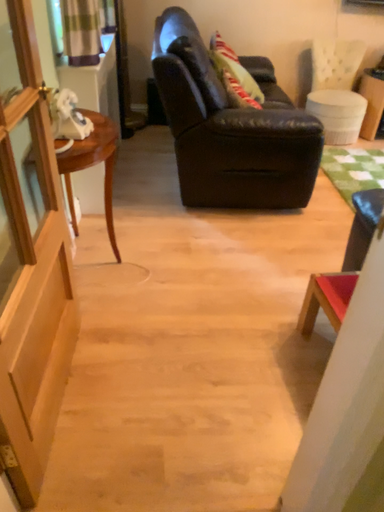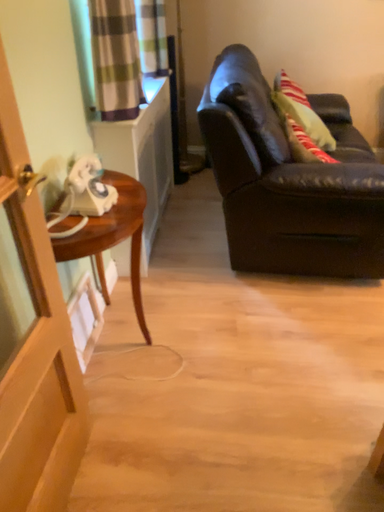
Question: How did the camera likely rotate when shooting the video?

Choices:
 (A) rotated right
 (B) rotated left

Answer: (B)